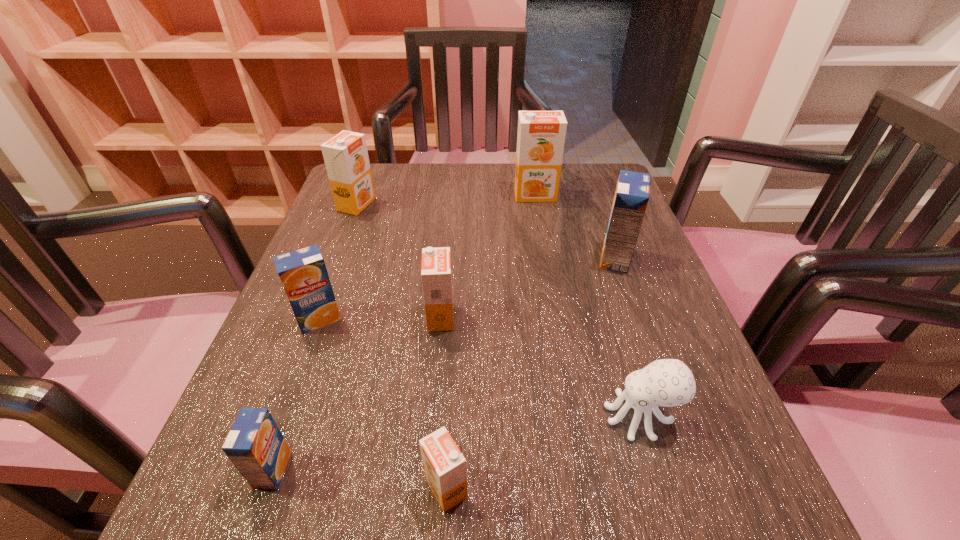
This screenshot has width=960, height=540. Find the location of `vacant space that is in between the biggest orange orange juice and the nearest orange orange juice`. vacant space that is in between the biggest orange orange juice and the nearest orange orange juice is located at coordinates (491, 341).

Find the location of a particular element. The width and height of the screenshot is (960, 540). blank region between the third biggest orange orange juice and the second nearest blue orange_juice is located at coordinates (380, 318).

You are a GUI agent. You are given a task and a screenshot of the screen. Output one action in this format:
    pyautogui.click(x=<x>, y=<y>)
    Task: Click on the free space between the second biggest orange orange juice and the third farthest orange orange juice
    The height and width of the screenshot is (540, 960).
    Given the screenshot: What is the action you would take?
    pyautogui.click(x=398, y=261)

Locate an element on the screen. vacant region between the smallest blue orange_juice and the second smallest orange orange juice is located at coordinates (357, 393).

Image resolution: width=960 pixels, height=540 pixels. Identify the location of empty location between the smallest orange orange juice and the second nearest orange orange juice. (444, 403).

This screenshot has height=540, width=960. What are the coordinates of `vacant area between the rightmost blue orange_juice and the second nearest orange orange juice` in the screenshot? It's located at (528, 287).

Find the location of a particular element. The width and height of the screenshot is (960, 540). unoccupied position between the nearest blue orange_juice and the white octopus is located at coordinates (456, 443).

You are a GUI agent. You are given a task and a screenshot of the screen. Output one action in this format:
    pyautogui.click(x=<x>, y=<y>)
    Task: Click on the free space between the second biggest blue orange_juice and the second nearest orange orange juice
    
    Given the screenshot: What is the action you would take?
    pyautogui.click(x=380, y=318)

What are the coordinates of `blank region between the white octopus and the tallest object` in the screenshot? It's located at (588, 306).

Locate which object is the fifth closest to the nearest blue orange_juice. Please provide its 2D coordinates. Your answer should be formatted as a tuple, i.e. [(x, y)], where the tuple contains the x and y coordinates of a point satisfying the conditions above.

[(346, 158)]